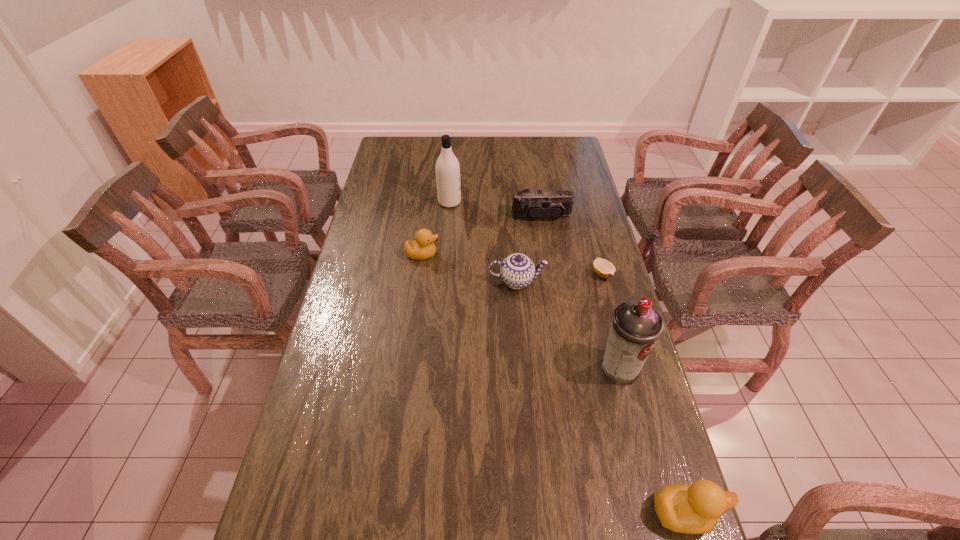
Find the location of a particular element. This screenshot has width=960, height=540. vacant space positioned 0.140m on the front-facing side of the farthest object is located at coordinates [x=495, y=202].

Locate an element on the screen. The image size is (960, 540). free space located 0.060m on the left of the lemon is located at coordinates (574, 274).

Locate an element on the screen. The width and height of the screenshot is (960, 540). free location located 0.140m on the front-facing side of the sixth nearest object is located at coordinates (546, 247).

The image size is (960, 540). Identify the location of free space located 0.080m at the spout of the chinaware. (569, 281).

This screenshot has width=960, height=540. What are the coordinates of `vacant area situated 0.260m on the left of the aerosol can` in the screenshot? It's located at (506, 369).

Locate an element on the screen. object that is at the near edge is located at coordinates (696, 509).

The height and width of the screenshot is (540, 960). Find the location of `duckling present at the right edge`. duckling present at the right edge is located at coordinates (696, 509).

Identify the location of lemon that is at the right edge. (603, 268).

Locate an element on the screen. Image resolution: width=960 pixels, height=540 pixels. camcorder present at the right edge is located at coordinates (536, 204).

What are the coordinates of `aerosol can at the right edge` in the screenshot? It's located at (636, 326).